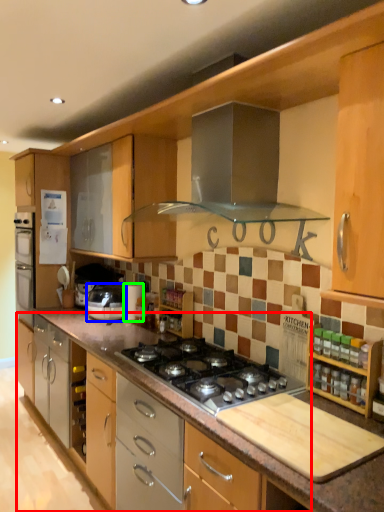
Question: Estimate the real-world distances between objects in this image. Which object is farther from cabinetry (highlighted by a red box), home appliance (highlighted by a blue box) or appliance (highlighted by a green box)?

Choices:
 (A) home appliance
 (B) appliance

Answer: (B)